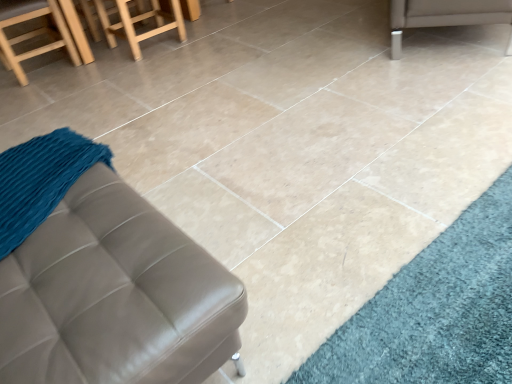
Question: Considering the relative positions of wooden stool at upper left and leather ottoman at lower left, placed as the first furniture when sorted from bottom to top, in the image provided, is wooden stool at upper left to the right of leather ottoman at lower left, placed as the first furniture when sorted from bottom to top, from the viewer's perspective?

Choices:
 (A) yes
 (B) no

Answer: (B)

Question: Can you confirm if wooden stool at upper left is positioned to the left of leather ottoman at lower left, the second furniture positioned from the back?

Choices:
 (A) no
 (B) yes

Answer: (B)

Question: Is wooden stool at upper left oriented away from leather ottoman at lower left, acting as the 2th furniture starting from the right?

Choices:
 (A) no
 (B) yes

Answer: (A)

Question: From a real-world perspective, does wooden stool at upper left stand above leather ottoman at lower left, acting as the 2th furniture starting from the top?

Choices:
 (A) yes
 (B) no

Answer: (B)

Question: Is wooden stool at upper left wider than leather ottoman at lower left, acting as the 2th furniture starting from the top?

Choices:
 (A) yes
 (B) no

Answer: (A)

Question: Relative to wooden stool at upper left, is leather ottoman at lower left, the second furniture positioned from the back, in front or behind?

Choices:
 (A) behind
 (B) front

Answer: (B)

Question: In terms of size, does leather ottoman at lower left, acting as the 2th furniture starting from the top, appear bigger or smaller than wooden stool at upper left?

Choices:
 (A) big
 (B) small

Answer: (A)

Question: Considering the positions of leather ottoman at lower left, placed as the 1th furniture when sorted from left to right, and wooden stool at upper left in the image, is leather ottoman at lower left, placed as the 1th furniture when sorted from left to right, taller or shorter than wooden stool at upper left?

Choices:
 (A) tall
 (B) short

Answer: (A)

Question: From a real-world perspective, is leather ottoman at lower left, the first furniture viewed from the front, physically located above or below wooden stool at upper left?

Choices:
 (A) above
 (B) below

Answer: (A)

Question: In the image, is silver metallic leg at upper right, marked as the first furniture in a right-to-left arrangement, on the left side or the right side of leather ottoman at lower left, the second furniture positioned from the back?

Choices:
 (A) left
 (B) right

Answer: (B)

Question: From the image's perspective, is silver metallic leg at upper right, acting as the 1th furniture starting from the back, positioned above or below leather ottoman at lower left, acting as the 2th furniture starting from the right?

Choices:
 (A) below
 (B) above

Answer: (B)

Question: Is silver metallic leg at upper right, the 2th furniture when ordered from left to right, wider or thinner than leather ottoman at lower left, the second furniture positioned from the back?

Choices:
 (A) thin
 (B) wide

Answer: (B)

Question: Is silver metallic leg at upper right, marked as the first furniture in a right-to-left arrangement, inside or outside of leather ottoman at lower left, acting as the 2th furniture starting from the top?

Choices:
 (A) outside
 (B) inside

Answer: (A)

Question: From the image's perspective, relative to wooden stool at upper left, is wooden stool at upper left above or below?

Choices:
 (A) below
 (B) above

Answer: (B)

Question: In terms of width, does wooden stool at upper left look wider or thinner when compared to wooden stool at upper left?

Choices:
 (A) wide
 (B) thin

Answer: (A)